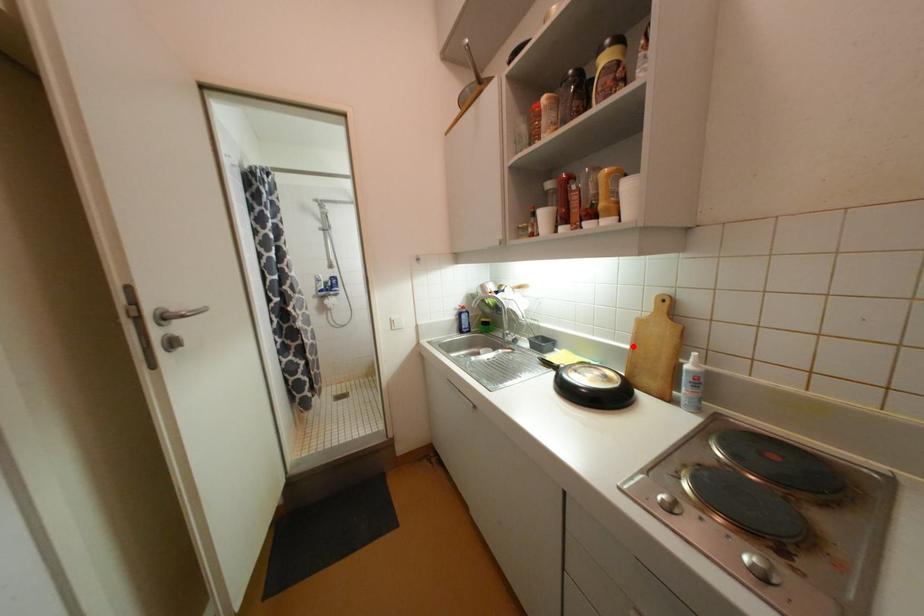
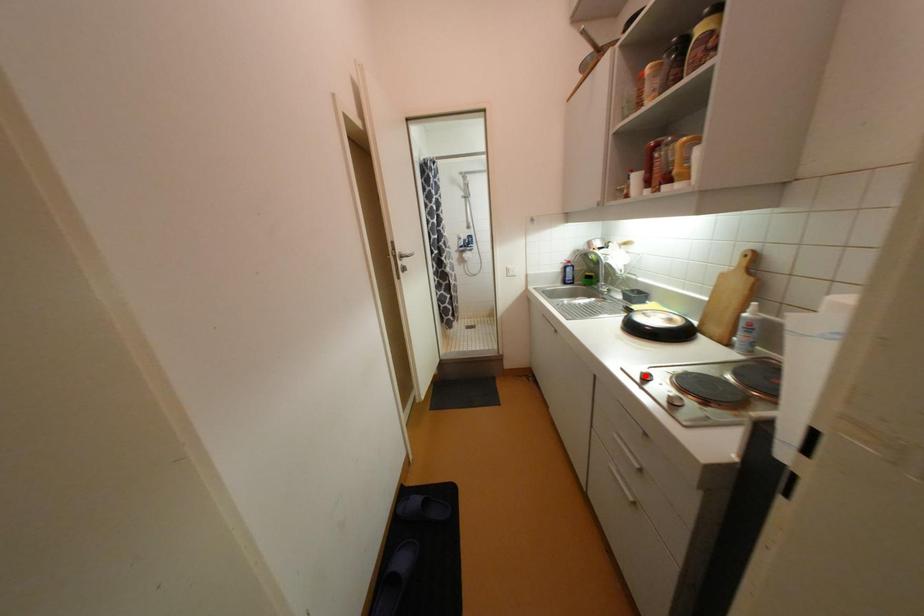
I am providing you with two images of the same scene from different viewpoints. A red point is marked on the first image and another point is marked on the second image. Does the point marked in image1 correspond to the same location as the one in image2?

No